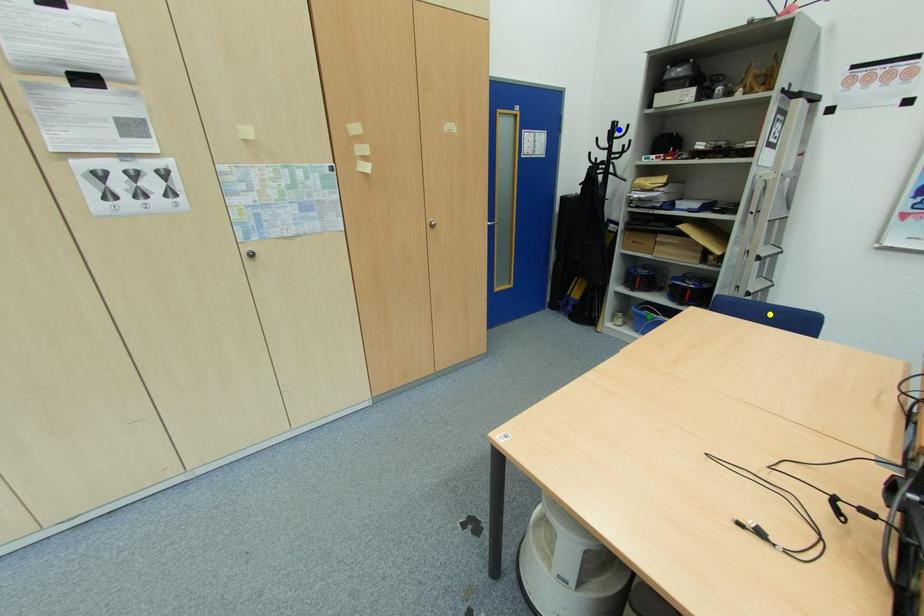
Order these from farthest to nearest:
yellow point, blue point, green point

1. green point
2. blue point
3. yellow point